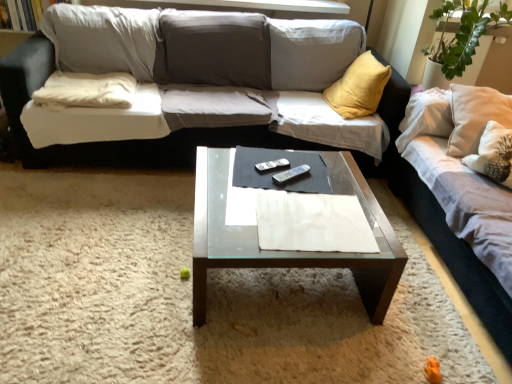
Question: Does white soft pillow at left have a greater width compared to black plastic remote at center, which ranks as the first remote in bottom-to-top order?

Choices:
 (A) no
 (B) yes

Answer: (B)

Question: From the image's perspective, is white soft pillow at left over black plastic remote at center, which is the second remote from top to bottom?

Choices:
 (A) no
 (B) yes

Answer: (B)

Question: From the image's perspective, is white soft pillow at left beneath black plastic remote at center, which is the second remote from top to bottom?

Choices:
 (A) yes
 (B) no

Answer: (B)

Question: Is white soft pillow at left looking in the opposite direction of black plastic remote at center, which ranks as the first remote in bottom-to-top order?

Choices:
 (A) no
 (B) yes

Answer: (A)

Question: From a real-world perspective, is white soft pillow at left positioned under black plastic remote at center, which ranks as the first remote in bottom-to-top order, based on gravity?

Choices:
 (A) yes
 (B) no

Answer: (B)

Question: Does white soft pillow at left have a greater height compared to black plastic remote at center, which ranks as the first remote in bottom-to-top order?

Choices:
 (A) yes
 (B) no

Answer: (A)

Question: Can you confirm if transparent glass coffee table at center is wider than white fabric couch at center, placed as the 1th studio couch when sorted from left to right?

Choices:
 (A) no
 (B) yes

Answer: (A)

Question: Does transparent glass coffee table at center lie in front of white fabric couch at center, placed as the 1th studio couch when sorted from left to right?

Choices:
 (A) yes
 (B) no

Answer: (A)

Question: Can you confirm if transparent glass coffee table at center is shorter than white fabric couch at center, placed as the 1th studio couch when sorted from left to right?

Choices:
 (A) yes
 (B) no

Answer: (A)

Question: Is transparent glass coffee table at center located outside white fabric couch at center, positioned as the second studio couch in right-to-left order?

Choices:
 (A) yes
 (B) no

Answer: (A)

Question: From a real-world perspective, is transparent glass coffee table at center positioned over white fabric couch at center, positioned as the second studio couch in right-to-left order, based on gravity?

Choices:
 (A) no
 (B) yes

Answer: (A)

Question: Can you confirm if transparent glass coffee table at center is positioned to the right of white fabric couch at center, placed as the 1th studio couch when sorted from left to right?

Choices:
 (A) no
 (B) yes

Answer: (B)

Question: Would you say transparent glass coffee table at center is part of white soft pillow at left's contents?

Choices:
 (A) no
 (B) yes

Answer: (A)